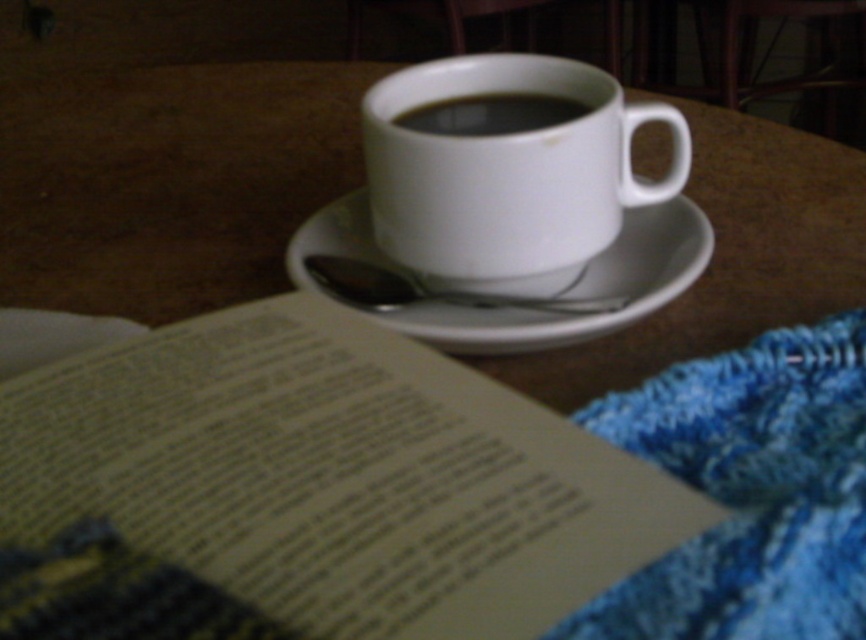
Question: Where is paper book at center located in relation to white ceramic mug at upper center in the image?

Choices:
 (A) above
 (B) below

Answer: (B)

Question: Which object is positioned closest to the white ceramic mug at upper center?

Choices:
 (A) paper book at center
 (B) white ceramic saucer at center
 (C) black matte cup at center

Answer: (C)

Question: Estimate the real-world distances between objects in this image. Which object is farther from the white ceramic mug at upper center?

Choices:
 (A) black matte cup at center
 (B) paper book at center
 (C) white ceramic saucer at center

Answer: (B)

Question: Is white ceramic mug at upper center thinner than black matte cup at center?

Choices:
 (A) yes
 (B) no

Answer: (B)

Question: Which object is farther from the camera taking this photo?

Choices:
 (A) white ceramic saucer at center
 (B) paper book at center

Answer: (A)

Question: Does white ceramic saucer at center have a smaller size compared to black matte cup at center?

Choices:
 (A) no
 (B) yes

Answer: (A)